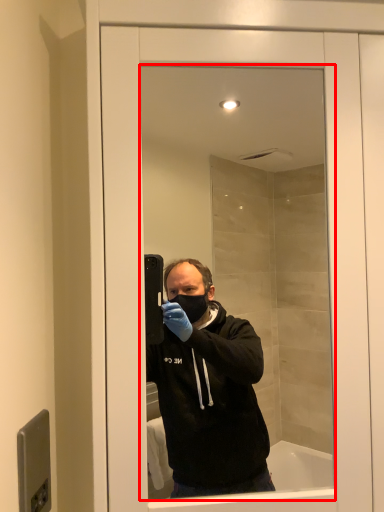
Question: From the image's perspective, what is the correct spatial relationship of mirror (annotated by the red box) in relation to door handle?

Choices:
 (A) above
 (B) below

Answer: (A)